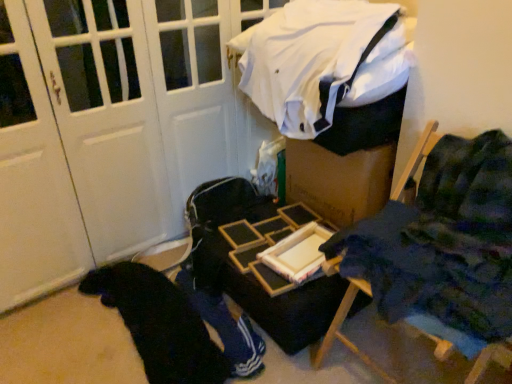
Question: Does wooden tray at center have a greater width compared to black fabric at lower left?

Choices:
 (A) no
 (B) yes

Answer: (A)

Question: Is wooden tray at center not within black fabric at lower left?

Choices:
 (A) no
 (B) yes

Answer: (B)

Question: Does wooden tray at center appear on the right side of black fabric at lower left?

Choices:
 (A) yes
 (B) no

Answer: (A)

Question: Can you see wooden tray at center touching black fabric at lower left?

Choices:
 (A) no
 (B) yes

Answer: (A)

Question: Is wooden tray at center positioned in front of black fabric at lower left?

Choices:
 (A) yes
 (B) no

Answer: (B)

Question: From the image's perspective, is wooden tray at center below black fabric at lower left?

Choices:
 (A) yes
 (B) no

Answer: (B)

Question: Does blue fabric chair at right lie in front of white fabric at upper center?

Choices:
 (A) no
 (B) yes

Answer: (B)

Question: From a real-world perspective, is blue fabric chair at right below white fabric at upper center?

Choices:
 (A) no
 (B) yes

Answer: (B)

Question: From the image's perspective, is blue fabric chair at right located beneath white fabric at upper center?

Choices:
 (A) no
 (B) yes

Answer: (B)

Question: Considering the relative sizes of blue fabric chair at right and white fabric at upper center in the image provided, is blue fabric chair at right thinner than white fabric at upper center?

Choices:
 (A) no
 (B) yes

Answer: (B)

Question: Would you consider blue fabric chair at right to be distant from white fabric at upper center?

Choices:
 (A) no
 (B) yes

Answer: (A)

Question: Is the position of blue fabric chair at right more distant than that of white fabric at upper center?

Choices:
 (A) yes
 (B) no

Answer: (B)

Question: From the image's perspective, does blue fabric chair at right appear lower than wooden tray at center?

Choices:
 (A) no
 (B) yes

Answer: (A)